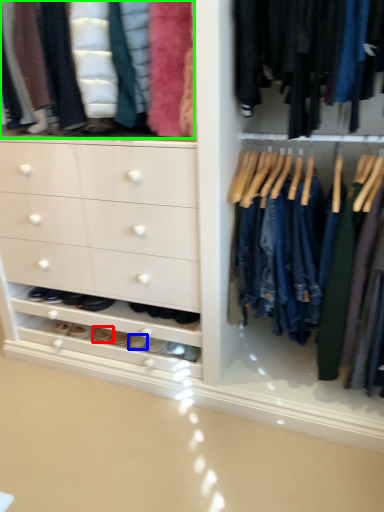
Question: Based on their relative distances, which object is nearer to footwear (highlighted by a red box)? Choose from footwear (highlighted by a blue box) and clothing (highlighted by a green box).

Choices:
 (A) footwear
 (B) clothing

Answer: (A)